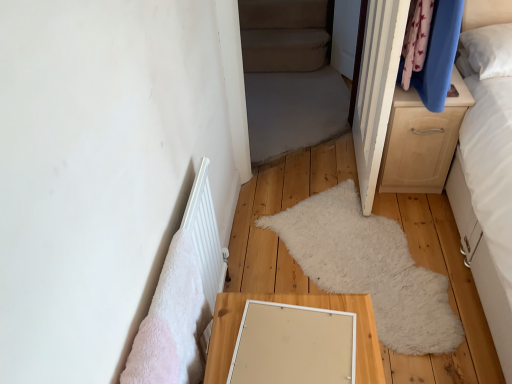
Question: Can you confirm if light wood/texture chest of drawers at right is positioned to the left of white matte radiator at lower left?

Choices:
 (A) yes
 (B) no

Answer: (B)

Question: Does light wood/texture chest of drawers at right have a smaller size compared to white matte radiator at lower left?

Choices:
 (A) no
 (B) yes

Answer: (A)

Question: Is white matte radiator at lower left at the back of light wood/texture chest of drawers at right?

Choices:
 (A) yes
 (B) no

Answer: (B)

Question: Is light wood/texture chest of drawers at right further to the viewer compared to white matte radiator at lower left?

Choices:
 (A) yes
 (B) no

Answer: (A)

Question: Is light wood/texture chest of drawers at right bigger than white matte radiator at lower left?

Choices:
 (A) yes
 (B) no

Answer: (A)

Question: Is there a large distance between light wood/texture chest of drawers at right and white matte radiator at lower left?

Choices:
 (A) yes
 (B) no

Answer: (A)

Question: Considering the relative sizes of white fluffy mat at center and light wood/texture table at lower center in the image provided, is white fluffy mat at center shorter than light wood/texture table at lower center?

Choices:
 (A) no
 (B) yes

Answer: (B)

Question: From the image's perspective, would you say white fluffy mat at center is positioned over light wood/texture table at lower center?

Choices:
 (A) no
 (B) yes

Answer: (B)

Question: Does white fluffy mat at center appear on the right side of light wood/texture table at lower center?

Choices:
 (A) yes
 (B) no

Answer: (A)

Question: Is white fluffy mat at center positioned behind light wood/texture table at lower center?

Choices:
 (A) no
 (B) yes

Answer: (B)

Question: From a real-world perspective, is white fluffy mat at center positioned over light wood/texture table at lower center based on gravity?

Choices:
 (A) yes
 (B) no

Answer: (B)

Question: From the image's perspective, would you say white fluffy mat at center is shown under light wood/texture table at lower center?

Choices:
 (A) no
 (B) yes

Answer: (A)

Question: Is beige fabric bed at center taller than light wood/texture chest of drawers at right?

Choices:
 (A) no
 (B) yes

Answer: (B)